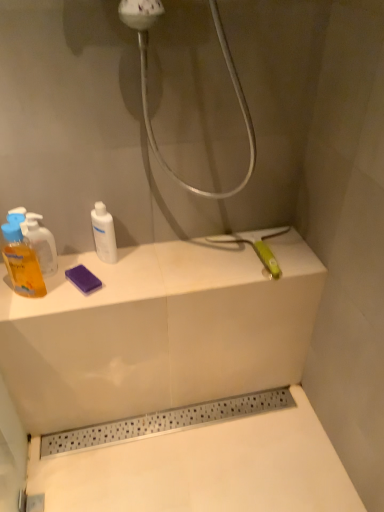
Identify the location of vacant space to the left of white glossy bottle at center, which is counted as the 3th mouthwash, starting from the left. (59, 269).